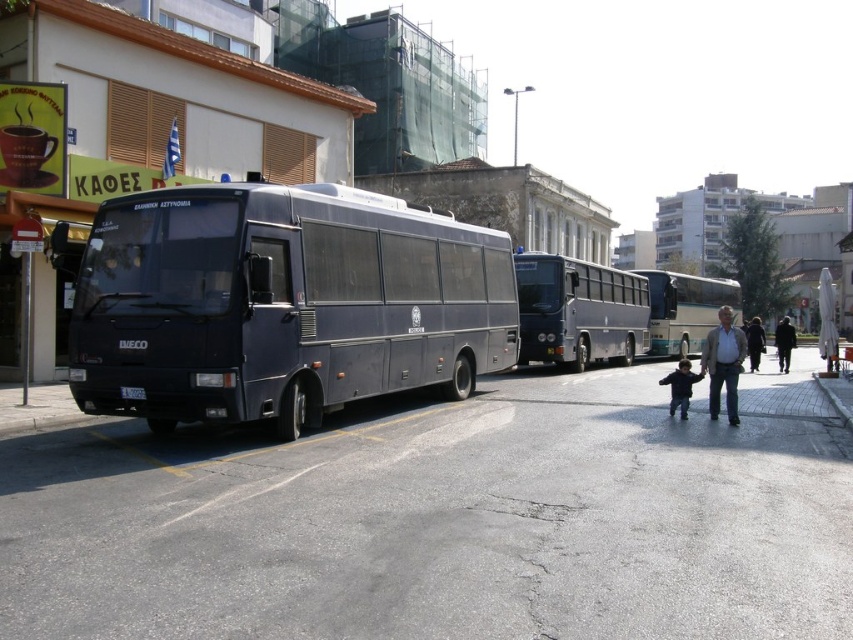
Question: Which point is farther from the camera taking this photo?

Choices:
 (A) pos(749,333)
 (B) pos(844,408)
 (C) pos(132,365)

Answer: (A)

Question: Can you confirm if metallic bus stop at left is positioned above dark blue sweater at center?

Choices:
 (A) yes
 (B) no

Answer: (A)

Question: Among these objects, which one is farthest from the camera?

Choices:
 (A) dark blue sweater at center
 (B) metallic bus stop at left

Answer: (B)

Question: Can you confirm if matte black bus at center is wider than dark blue jacket at center?

Choices:
 (A) no
 (B) yes

Answer: (A)

Question: Does dark blue sweater at center have a larger size compared to gray concrete curb at lower right?

Choices:
 (A) yes
 (B) no

Answer: (A)

Question: Which object is positioned closest to the light brown leather jacket at lower right?

Choices:
 (A) metallic bus stop at left
 (B) black fabric coat at lower right

Answer: (B)